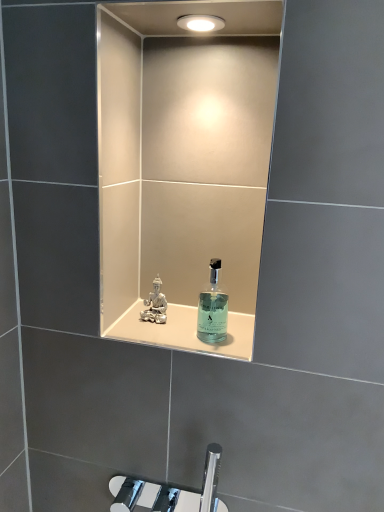
At what (x,y) coordinates should I click in order to perform the action: click on free point above translucent glass bottle at center (from a real-world perspective). Please return your answer as a coordinate pair (x, y). The image size is (384, 512). Looking at the image, I should click on (185, 325).